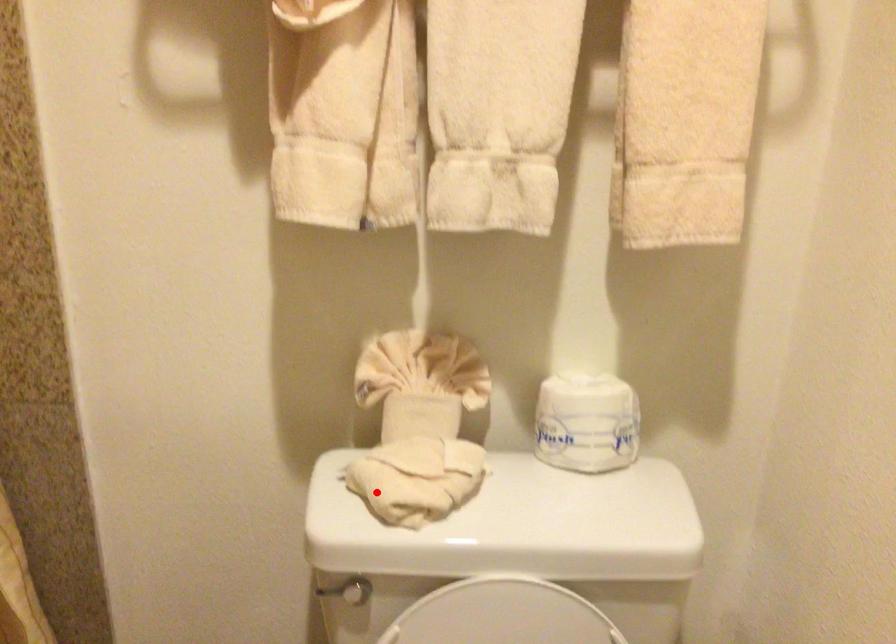
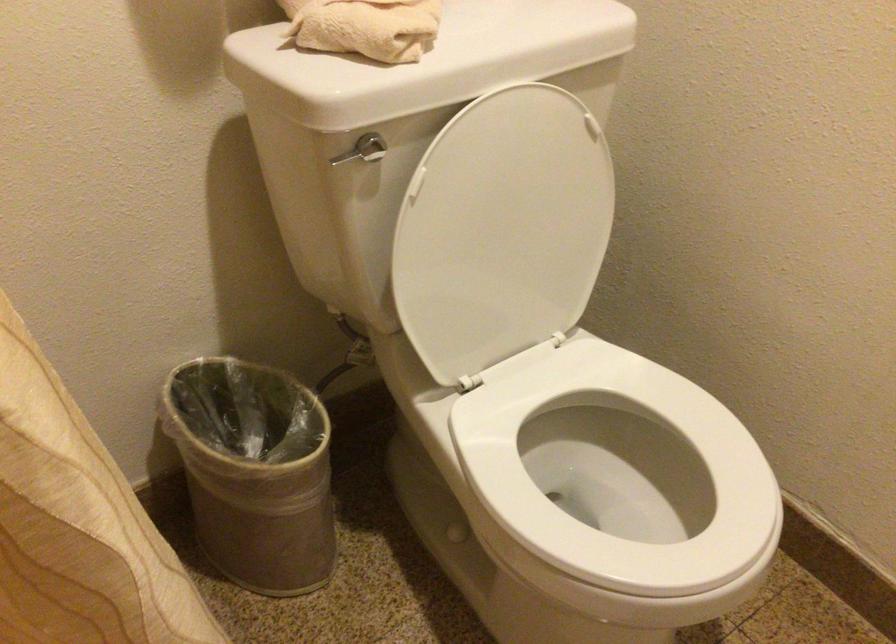
Locate, in the second image, the point that corresponds to the highlighted location in the first image.

(365, 26)